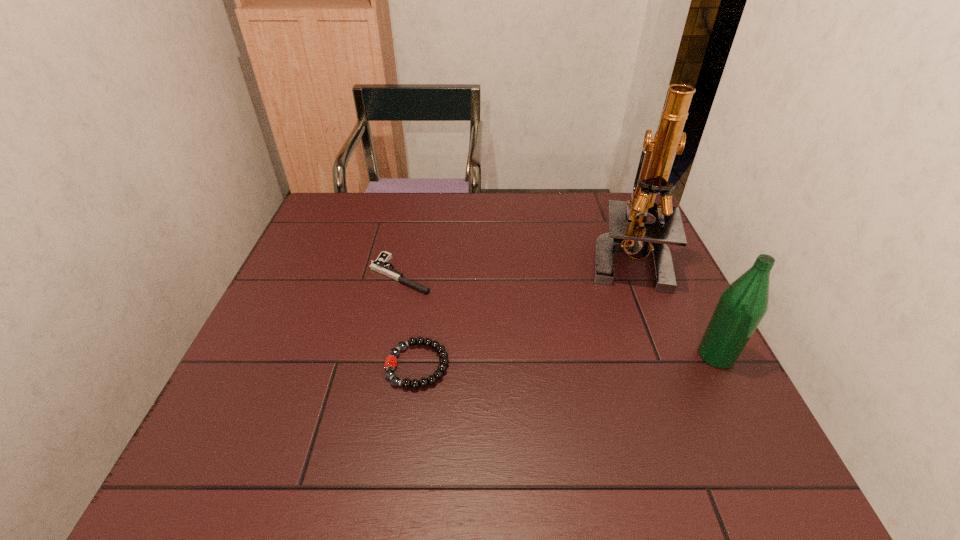
The height and width of the screenshot is (540, 960). I want to click on vacant space in between the microscope and the second shortest object, so click(522, 312).

The image size is (960, 540). Find the location of `free space between the third tallest object and the pistol`. free space between the third tallest object and the pistol is located at coordinates (409, 320).

Point out which object is positioned as the nearest to the shortest object. Please provide its 2D coordinates. Your answer should be formatted as a tuple, i.e. [(x, y)], where the tuple contains the x and y coordinates of a point satisfying the conditions above.

[(406, 383)]

Choose which object is the second nearest neighbor to the third tallest object. Please provide its 2D coordinates. Your answer should be formatted as a tuple, i.e. [(x, y)], where the tuple contains the x and y coordinates of a point satisfying the conditions above.

[(628, 231)]

Find the location of a particular element. vacant space that satisfies the following two spatial constraints: 1. on the back side of the microscope; 2. on the right side of the shortest object is located at coordinates (404, 258).

You are a GUI agent. You are given a task and a screenshot of the screen. Output one action in this format:
    pyautogui.click(x=<x>, y=<y>)
    Task: Click on the free spot that satisfies the following two spatial constraints: 1. on the front side of the microscope; 2. on the left side of the second tallest object
    This screenshot has height=540, width=960.
    Given the screenshot: What is the action you would take?
    pyautogui.click(x=665, y=355)

What are the coordinates of `vacant space that satisfies the following two spatial constraints: 1. on the front side of the bracelet; 2. on the left side of the shortest object` in the screenshot? It's located at (381, 366).

Identify the location of free space that satisfies the following two spatial constraints: 1. on the back side of the second shortest object; 2. on the left side of the second tallest object. The image size is (960, 540). (419, 355).